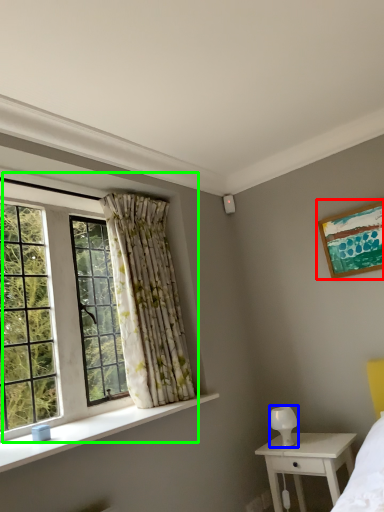
Question: Based on their relative distances, which object is farther from picture frame (highlighted by a red box)? Choose from lamp (highlighted by a blue box) and window (highlighted by a green box).

Choices:
 (A) lamp
 (B) window

Answer: (B)